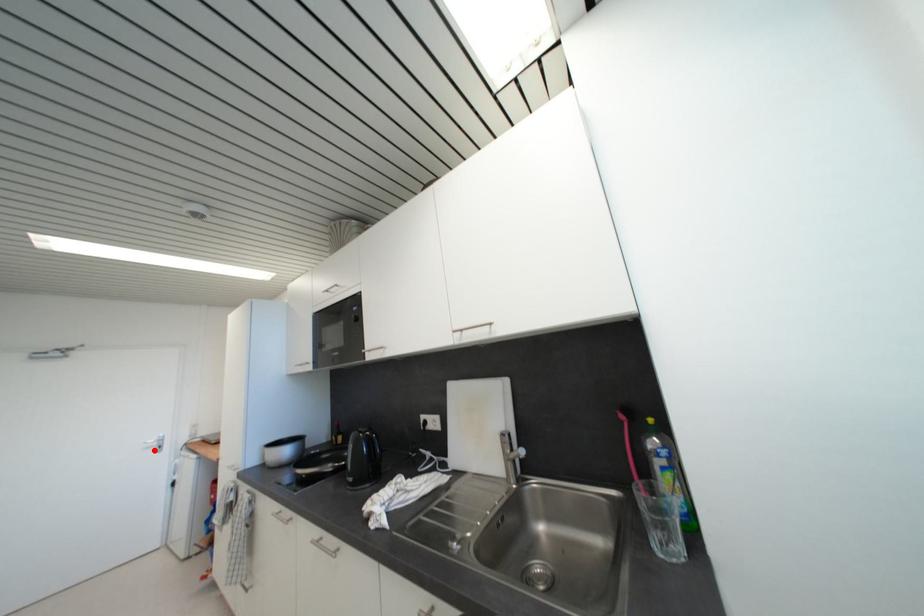
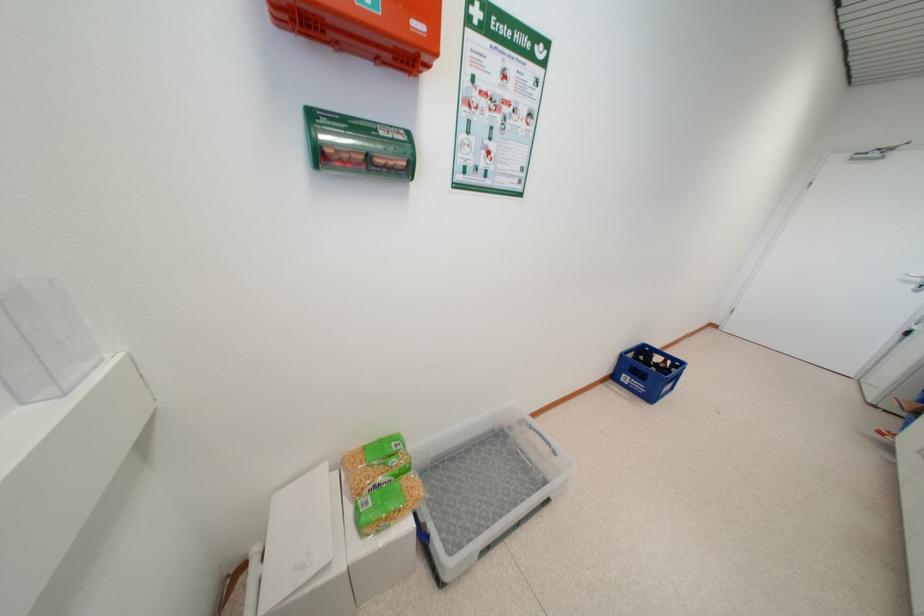
Where in the second image is the point corresponding to the highlighted location from the first image?

(912, 284)